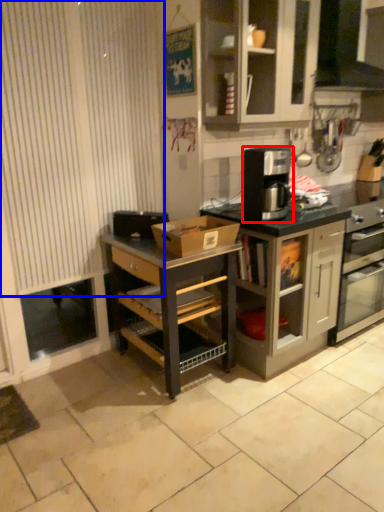
Question: Which point is further to the camera, kitchen appliance (highlighted by a red box) or curtain (highlighted by a blue box)?

Choices:
 (A) kitchen appliance
 (B) curtain

Answer: (A)